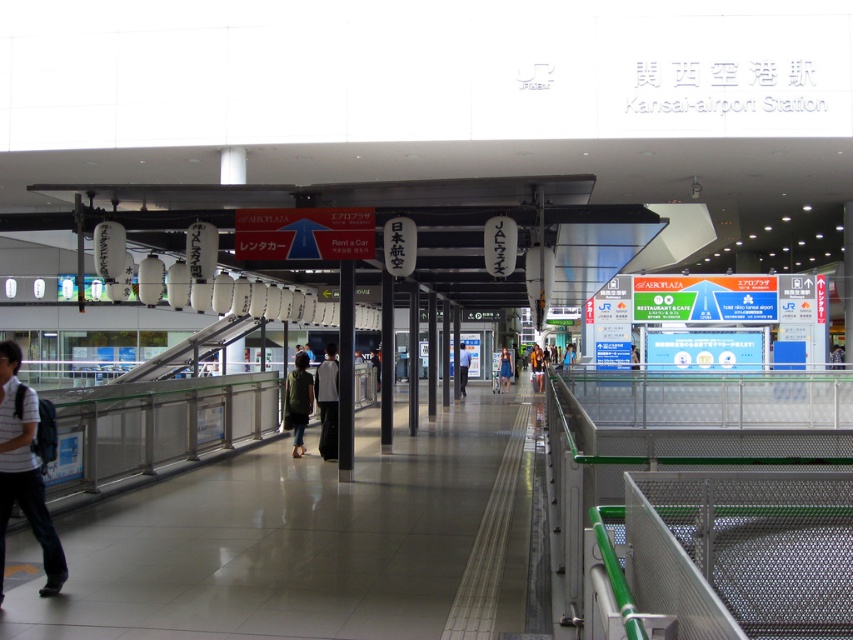
You are a traveler at Kansai Airport Station and you see two jackets hanging on a coat rack. The dark gray fabric jacket at center and the blue denim jacket at center. Which jacket is placed higher on the coat rack?

The dark gray fabric jacket at center is located above the blue denim jacket at center, so it is placed higher on the coat rack.

In the scene shown: You are a store manager at the airport and need to display two jackets in a narrow display case. The dark gray fabric jacket at center and the blue denim jacket at center are both candidates. Which jacket should you choose to ensure it fits better in the case?

The dark gray fabric jacket at center has a smaller width than the blue denim jacket at center, so it will fit better in the narrow display case.

You are a photographer at Kansai Airport Station. You see a person wearing a blue fabric dress at center and another wearing a blue denim jacket at center. Which clothing item is located to the left when viewed from the front?

The blue fabric dress at center is positioned on the left side of the blue denim jacket at center, so the blue fabric dress at center is located to the left.